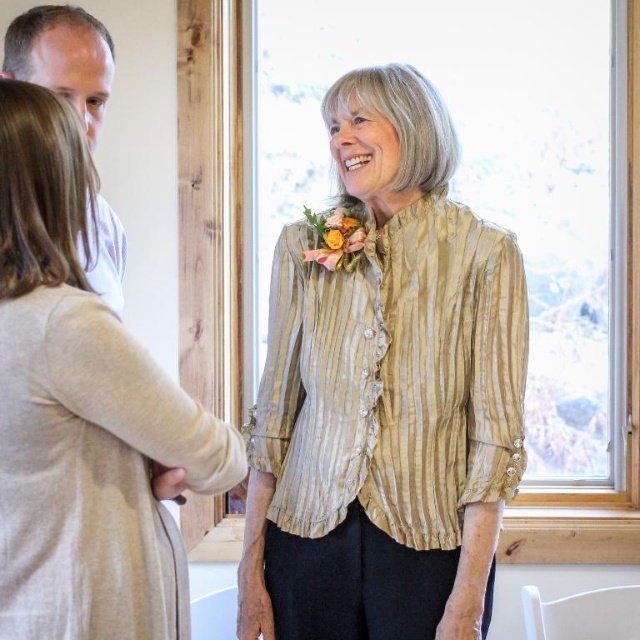
You are planning to wear a gold striped blouse at center and a white cotton shirt at upper left for an event. Based on the image, which clothing item has a wider width?

The gold striped blouse at center has a larger width than the white cotton shirt at upper left according to the description.

You are an interior designer working on a layout for a cozy living room. You need to place a sofa in the corner where the white cotton shirt at upper left is located. What coordinates should you use for the sofa placement?

The coordinates for placing the sofa should be at point (61, 58) where the white cotton shirt at upper left is located.

From the picture: You are a photographer setting up for a group photo. You have two subjects wearing the gold striped blouse at center and the white cotton shirt at upper left. Based on their clothing sizes, which subject should you position closer to the camera to make both appear equally sized in the final photo?

The gold striped blouse at center is larger in size than the white cotton shirt at upper left. To make both appear equally sized in the photo, position the smaller white cotton shirt at upper left closer to the camera.